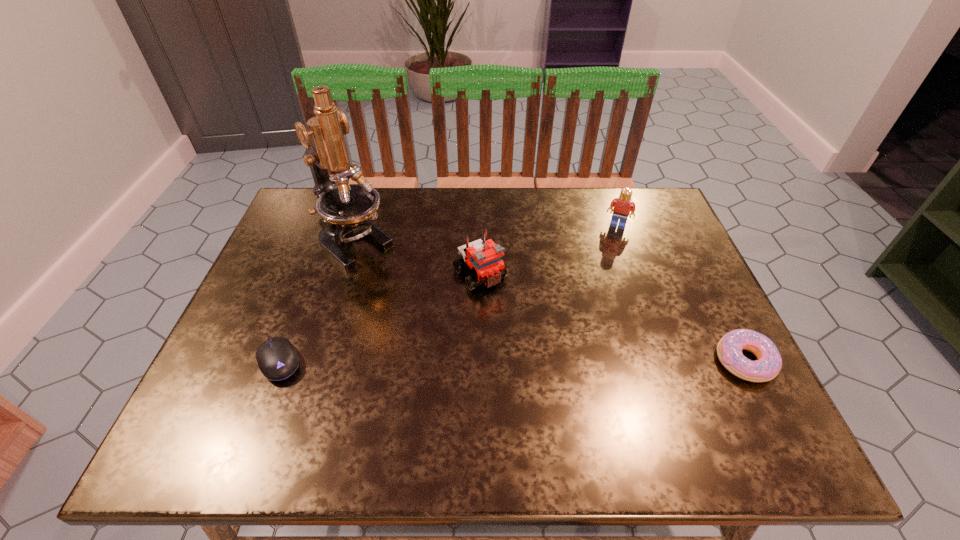
Where is `Lego that is at the far edge`? This screenshot has height=540, width=960. Lego that is at the far edge is located at coordinates (x=623, y=205).

Locate an element on the screen. The height and width of the screenshot is (540, 960). computer mouse present at the near edge is located at coordinates (277, 359).

Where is `doughnut located at the near edge`? This screenshot has height=540, width=960. doughnut located at the near edge is located at coordinates (729, 349).

Where is `computer mouse located at the left edge`? This screenshot has width=960, height=540. computer mouse located at the left edge is located at coordinates pyautogui.click(x=277, y=359).

Identify the location of microscope that is at the left edge. Image resolution: width=960 pixels, height=540 pixels. (344, 208).

This screenshot has width=960, height=540. I want to click on doughnut located in the right edge section of the desktop, so click(x=729, y=349).

I want to click on Lego located in the right edge section of the desktop, so click(623, 205).

Image resolution: width=960 pixels, height=540 pixels. Find the location of `object at the far left corner`. object at the far left corner is located at coordinates (344, 208).

This screenshot has height=540, width=960. I want to click on object that is at the near left corner, so click(x=277, y=359).

Locate an element on the screen. object located at the far right corner is located at coordinates (623, 205).